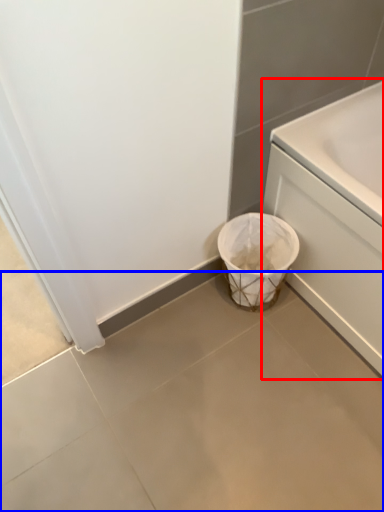
Question: Which of the following is the farthest to the observer, bath (highlighted by a red box) or concrete (highlighted by a blue box)?

Choices:
 (A) bath
 (B) concrete

Answer: (A)